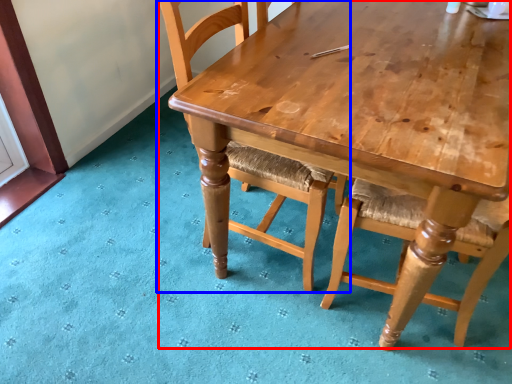
Question: Which of the following is the closest to the observer, table (highlighted by a red box) or chair (highlighted by a blue box)?

Choices:
 (A) table
 (B) chair

Answer: (A)